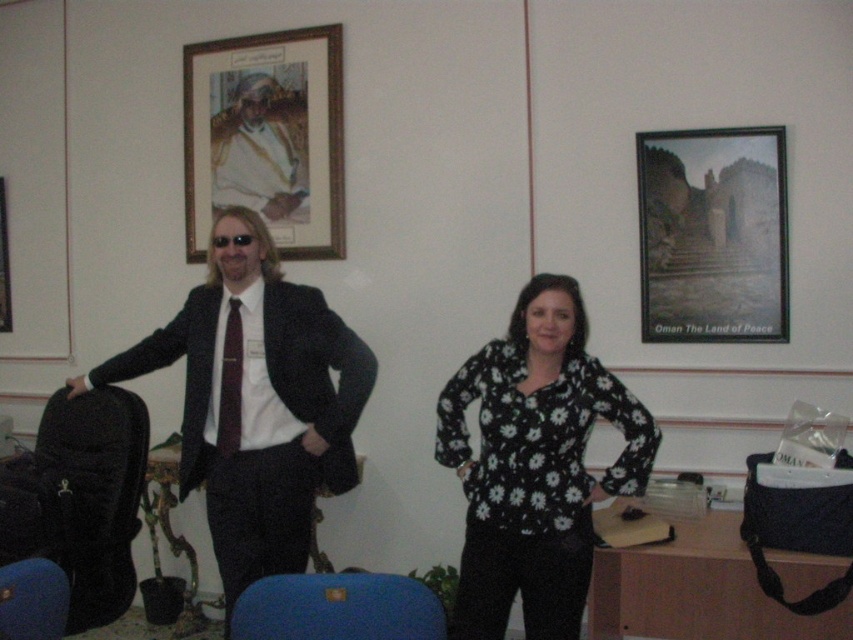
Question: Estimate the real-world distances between objects in this image. Which object is closer to the matte black suit at center?

Choices:
 (A) black floral blouse at center
 (B) wooden frame at upper center
 (C) sunglasses at center

Answer: (C)

Question: Which object appears closest to the camera in this image?

Choices:
 (A) white satin suit at center
 (B) wooden frame at upper center
 (C) matte black frame at upper right

Answer: (C)

Question: Which object is closer to the camera taking this photo?

Choices:
 (A) sunglasses at center
 (B) white satin suit at center
 (C) wooden frame at upper center
 (D) black floral blouse at center

Answer: (D)

Question: Observing the image, what is the correct spatial positioning of black floral blouse at center in reference to wooden frame at upper center?

Choices:
 (A) above
 (B) below

Answer: (B)

Question: Can you confirm if black satin suit at left is bigger than dark red satin tie at left?

Choices:
 (A) no
 (B) yes

Answer: (B)

Question: Is the position of matte black suit at center less distant than that of wooden frame at upper center?

Choices:
 (A) no
 (B) yes

Answer: (B)